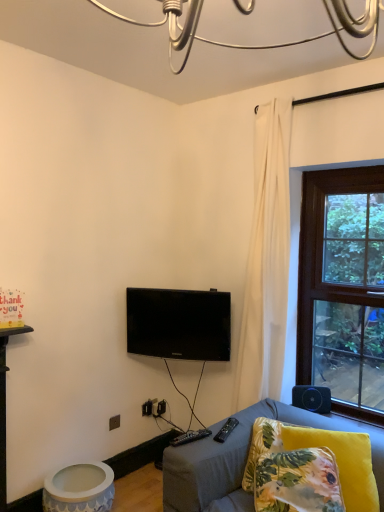
Question: From the image's perspective, is black fabric speaker at lower right on top of black plastic remote at lower center, the second remote in the left-to-right sequence?

Choices:
 (A) no
 (B) yes

Answer: (A)

Question: From a real-world perspective, does black fabric speaker at lower right sit lower than black plastic remote at lower center, positioned as the first remote in right-to-left order?

Choices:
 (A) no
 (B) yes

Answer: (B)

Question: Are black fabric speaker at lower right and black plastic remote at lower center, the second remote in the left-to-right sequence, located far from each other?

Choices:
 (A) yes
 (B) no

Answer: (B)

Question: Considering the relative sizes of black fabric speaker at lower right and black plastic remote at lower center, the second remote in the left-to-right sequence, in the image provided, is black fabric speaker at lower right shorter than black plastic remote at lower center, the second remote in the left-to-right sequence,?

Choices:
 (A) yes
 (B) no

Answer: (B)

Question: Is black fabric speaker at lower right smaller than black plastic remote at lower center, positioned as the first remote in right-to-left order?

Choices:
 (A) no
 (B) yes

Answer: (A)

Question: From the image's perspective, is matte white ceramic table at lower left positioned above or below black glossy tv at center?

Choices:
 (A) above
 (B) below

Answer: (B)

Question: Is point (66, 470) closer or farther from the camera than point (145, 351)?

Choices:
 (A) closer
 (B) farther

Answer: (A)

Question: Considering their positions, is matte white ceramic table at lower left located in front of or behind black glossy tv at center?

Choices:
 (A) front
 (B) behind

Answer: (A)

Question: From a real-world perspective, relative to black glossy tv at center, is matte white ceramic table at lower left vertically above or below?

Choices:
 (A) below
 (B) above

Answer: (A)

Question: Considering their positions, is yellow floral pillow at lower right, which appears as the 2th pillow when viewed from the right, located in front of or behind yellow floral fabric pillow at lower right, arranged as the first pillow when viewed from the right?

Choices:
 (A) behind
 (B) front

Answer: (B)

Question: From the image's perspective, relative to yellow floral fabric pillow at lower right, marked as the 2th pillow in a left-to-right arrangement, is yellow floral pillow at lower right, the first pillow when ordered from left to right, above or below?

Choices:
 (A) above
 (B) below

Answer: (B)

Question: Is point (311, 507) positioned closer to the camera than point (377, 498)?

Choices:
 (A) farther
 (B) closer

Answer: (B)

Question: Looking at the image, does yellow floral pillow at lower right, which appears as the 2th pillow when viewed from the right, seem bigger or smaller compared to yellow floral fabric pillow at lower right, arranged as the first pillow when viewed from the right?

Choices:
 (A) big
 (B) small

Answer: (B)

Question: From a real-world perspective, is matte white ceramic table at lower left positioned above or below yellow floral pillow at lower right, the first pillow when ordered from left to right?

Choices:
 (A) above
 (B) below

Answer: (B)

Question: Is matte white ceramic table at lower left inside the boundaries of yellow floral pillow at lower right, which appears as the 2th pillow when viewed from the right, or outside?

Choices:
 (A) outside
 (B) inside

Answer: (A)